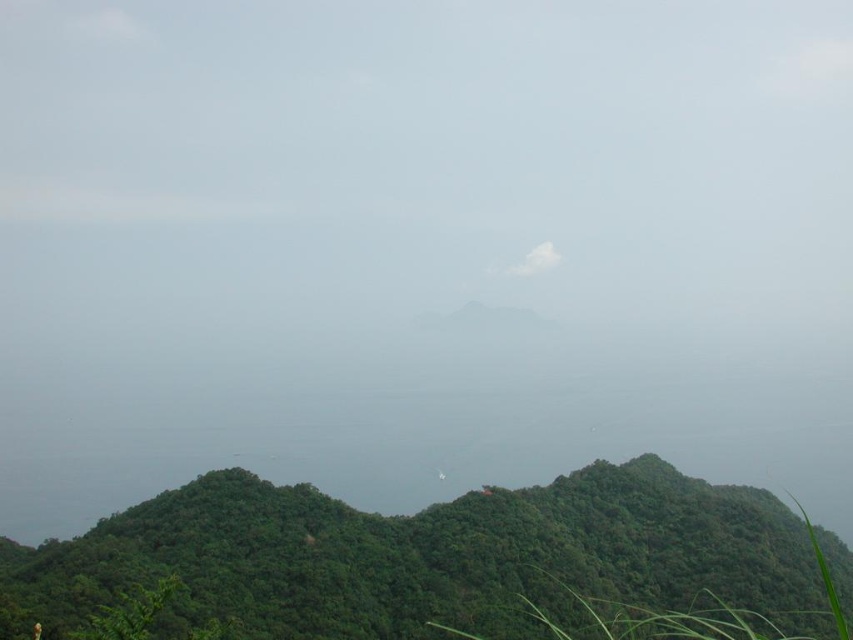
Question: Among these objects, which one is nearest to the camera?

Choices:
 (A) white fluffy cloud at center
 (B) green leafy vegetation at center

Answer: (B)

Question: Which point is farther from the camera taking this photo?

Choices:
 (A) (515, 260)
 (B) (460, 566)

Answer: (A)

Question: Is green leafy vegetation at center to the left of white fluffy cloud at center from the viewer's perspective?

Choices:
 (A) no
 (B) yes

Answer: (B)

Question: Is green leafy vegetation at center thinner than white fluffy cloud at center?

Choices:
 (A) yes
 (B) no

Answer: (B)

Question: Observing the image, what is the correct spatial positioning of green leafy vegetation at center in reference to white fluffy cloud at center?

Choices:
 (A) right
 (B) left

Answer: (B)